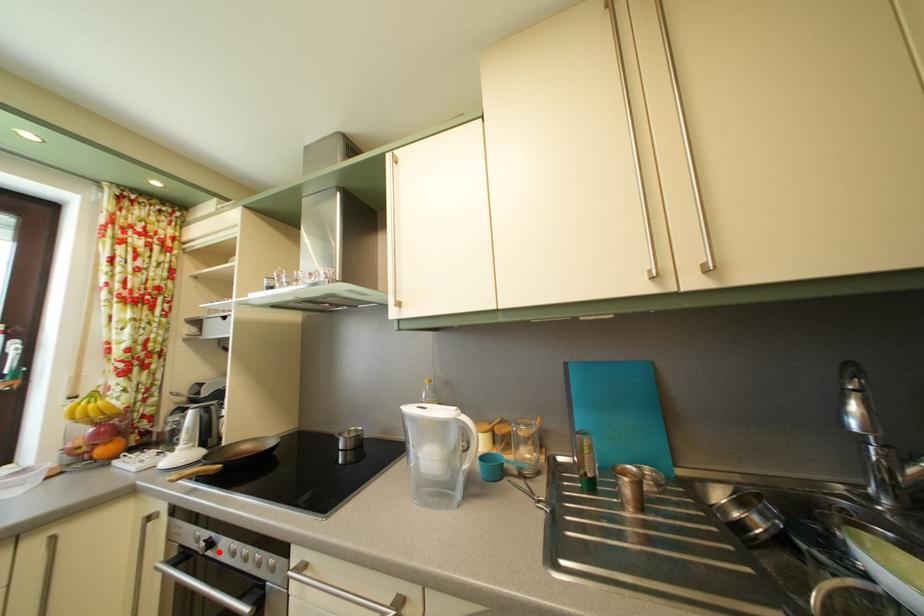
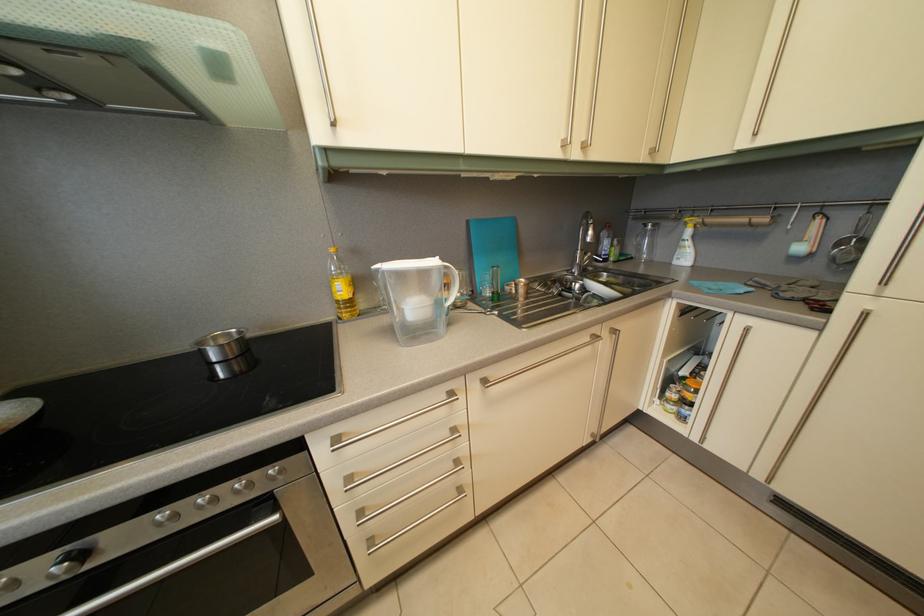
Locate, in the second image, the point that corresponds to the highlighted location in the first image.

(92, 562)